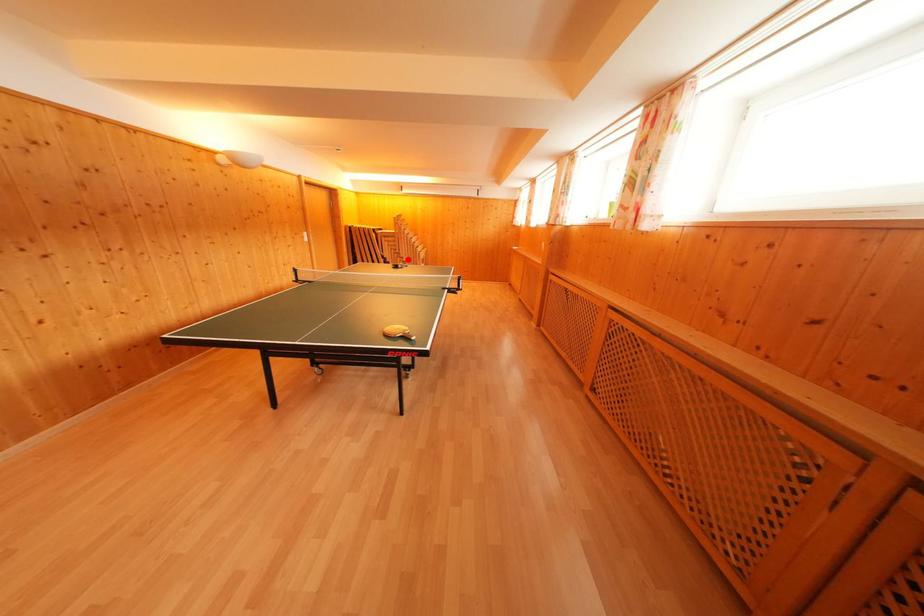
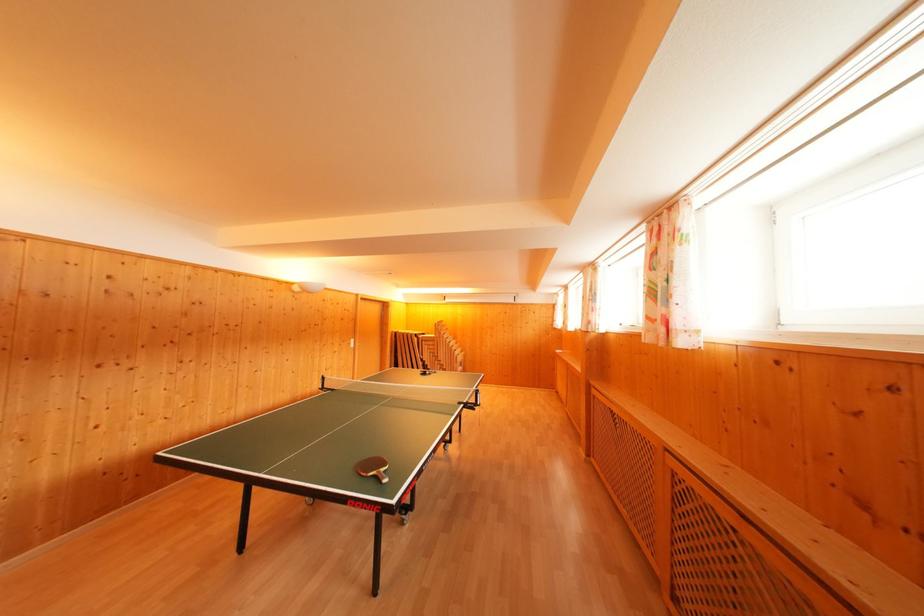
In the second image, find the point that corresponds to the highlighted location in the first image.

(445, 362)